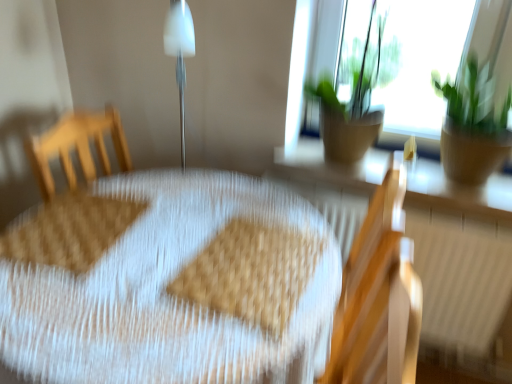
Measure the distance between point (x=437, y=293) and camera.

4.91 feet.

Where is `green leafy plant at upper right, arranged as the first houseplant when viewed from the right`? Image resolution: width=512 pixels, height=384 pixels. green leafy plant at upper right, arranged as the first houseplant when viewed from the right is located at coordinates (473, 126).

This screenshot has height=384, width=512. Describe the element at coordinates (352, 79) in the screenshot. I see `brown textured pot at upper right, which appears as the 1th houseplant when viewed from the left` at that location.

Find the location of a particular element. The width and height of the screenshot is (512, 384). wooden radiator at lower right is located at coordinates (462, 278).

Identify the location of radiator beneath the white woven table at center (from a real-world perspective). The width and height of the screenshot is (512, 384). (462, 278).

Between wooden radiator at lower right and white woven table at center, which one has larger size?

With larger size is white woven table at center.

Considering the relative sizes of wooden radiator at lower right and white woven table at center in the image provided, is wooden radiator at lower right wider than white woven table at center?

No, wooden radiator at lower right is not wider than white woven table at center.

Is point (436, 312) closer to camera compared to point (303, 354)?

No, (436, 312) is further to viewer.

Does white woven table at center turn towards wooden radiator at lower right?

No, white woven table at center is not turned towards wooden radiator at lower right.

Is white woven table at center placed right next to wooden radiator at lower right?

No.

Can you tell me how much white woven table at center and wooden radiator at lower right differ in facing direction?

1.21 degrees.

Which object is wider, white woven table at center or wooden radiator at lower right?

Wider between the two is white woven table at center.

At what (x,y) coordinates should I click in order to perform the action: click on the 2nd houseplant positioned above the white woven table at center (from a real-world perspective). Please return your answer as a coordinate pair (x, y). This screenshot has height=384, width=512. Looking at the image, I should click on (352, 79).

Is white woven table at center placed right next to brown textured pot at upper right, which appears as the 1th houseplant when viewed from the left?

No, white woven table at center is not with brown textured pot at upper right, which appears as the 1th houseplant when viewed from the left.

From a real-world perspective, which object stands above the other?

brown textured pot at upper right, marked as the second houseplant in a right-to-left arrangement, from a real-world perspective.

Between matte brown wood at upper right and green leafy plant at upper right, the second houseplant when ordered from left to right, which one is positioned behind?

matte brown wood at upper right is further away from the camera.

Which is closer to the camera, (423, 181) or (459, 151)?

Clearly, point (423, 181) is more distant from the camera than point (459, 151).

From a real-world perspective, is matte brown wood at upper right located higher than green leafy plant at upper right, arranged as the first houseplant when viewed from the right?

Actually, matte brown wood at upper right is physically below green leafy plant at upper right, arranged as the first houseplant when viewed from the right, in the real world.

How much distance is there between matte brown wood at upper right and green leafy plant at upper right, the second houseplant when ordered from left to right?

matte brown wood at upper right is 8.29 inches away from green leafy plant at upper right, the second houseplant when ordered from left to right.

Which of these two, brown textured pot at upper right, marked as the second houseplant in a right-to-left arrangement, or green leafy plant at upper right, arranged as the first houseplant when viewed from the right, is bigger?

Bigger between the two is brown textured pot at upper right, marked as the second houseplant in a right-to-left arrangement.

Can you tell me how much brown textured pot at upper right, marked as the second houseplant in a right-to-left arrangement, and green leafy plant at upper right, the second houseplant when ordered from left to right, differ in facing direction?

The facing directions of brown textured pot at upper right, marked as the second houseplant in a right-to-left arrangement, and green leafy plant at upper right, the second houseplant when ordered from left to right, are 1.1 degrees apart.

Is brown textured pot at upper right, which appears as the 1th houseplant when viewed from the left, turned away from green leafy plant at upper right, the second houseplant when ordered from left to right?

brown textured pot at upper right, which appears as the 1th houseplant when viewed from the left, does not have its back to green leafy plant at upper right, the second houseplant when ordered from left to right.

Is point (328, 68) more distant than point (481, 176)?

Yes, point (328, 68) is behind point (481, 176).

Is green leafy plant at upper right, the second houseplant when ordered from left to right, surrounding wooden chair at right?

No, wooden chair at right is located outside of green leafy plant at upper right, the second houseplant when ordered from left to right.

Is green leafy plant at upper right, arranged as the first houseplant when viewed from the right, wider than wooden chair at right?

Yes.

Which object is positioned more to the left, green leafy plant at upper right, arranged as the first houseplant when viewed from the right, or wooden chair at right?

Positioned to the left is wooden chair at right.

Considering the sizes of green leafy plant at upper right, arranged as the first houseplant when viewed from the right, and wooden chair at right in the image, is green leafy plant at upper right, arranged as the first houseplant when viewed from the right, bigger or smaller than wooden chair at right?

Considering their sizes, green leafy plant at upper right, arranged as the first houseplant when viewed from the right, takes up less space than wooden chair at right.

Between point (301, 217) and point (334, 379), which one is positioned behind?

Positioned behind is point (301, 217).

Which object is further away from the camera, white woven table at center or wooden chair at right?

wooden chair at right is further from the camera.

Would you say white woven table at center is inside or outside wooden chair at right?

white woven table at center cannot be found inside wooden chair at right.

Which is more to the right, white woven table at center or wooden chair at right?

wooden chair at right.

You are a GUI agent. You are given a task and a screenshot of the screen. Output one action in this format:
    pyautogui.click(x=<x>, y=<y>)
    Task: Click on the radiator that is on the right side of white woven table at center
    
    Given the screenshot: What is the action you would take?
    pyautogui.click(x=462, y=278)

Where is `radiator lying above the white woven table at center (from the image's perspective)`? radiator lying above the white woven table at center (from the image's perspective) is located at coordinates (462, 278).

From the image, which object appears to be nearer to brown textured pot at upper right, marked as the second houseplant in a right-to-left arrangement, green leafy plant at upper right, arranged as the first houseplant when viewed from the right, or matte brown wood at upper right?

The object closer to brown textured pot at upper right, marked as the second houseplant in a right-to-left arrangement, is matte brown wood at upper right.

Estimate the real-world distances between objects in this image. Which object is closer to wooden chair at right, wooden radiator at lower right or green leafy plant at upper right, arranged as the first houseplant when viewed from the right?

wooden radiator at lower right is positioned closer to the anchor wooden chair at right.

Considering their positions, is matte brown wood at upper right positioned closer to wooden radiator at lower right than white woven table at center?

matte brown wood at upper right lies closer to wooden radiator at lower right than the other object.

Based on their spatial positions, is wooden chair at right or wooden radiator at lower right closer to green leafy plant at upper right, the second houseplant when ordered from left to right?

Based on the image, wooden radiator at lower right appears to be nearer to green leafy plant at upper right, the second houseplant when ordered from left to right.

From the image, which object appears to be nearer to matte brown wood at upper right, white woven table at center or green leafy plant at upper right, the second houseplant when ordered from left to right?

Among the two, green leafy plant at upper right, the second houseplant when ordered from left to right, is located nearer to matte brown wood at upper right.

When comparing their distances from wooden radiator at lower right, does white woven table at center or matte brown wood at upper right seem further?

Based on the image, white woven table at center appears to be further to wooden radiator at lower right.

Based on their spatial positions, is white woven table at center or wooden chair at right closer to brown textured pot at upper right, which appears as the 1th houseplant when viewed from the left?

wooden chair at right.

When comparing their distances from white woven table at center, does brown textured pot at upper right, which appears as the 1th houseplant when viewed from the left, or green leafy plant at upper right, arranged as the first houseplant when viewed from the right, seem closer?

brown textured pot at upper right, which appears as the 1th houseplant when viewed from the left, is positioned closer to the anchor white woven table at center.

This screenshot has width=512, height=384. Identify the location of radiator between matte brown wood at upper right and wooden chair at right in the vertical direction. (462, 278).

Image resolution: width=512 pixels, height=384 pixels. Find the location of `houseplant between brown textured pot at upper right, marked as the second houseplant in a right-to-left arrangement, and wooden radiator at lower right vertically`. houseplant between brown textured pot at upper right, marked as the second houseplant in a right-to-left arrangement, and wooden radiator at lower right vertically is located at coordinates (x=473, y=126).

Where is `window sill between brown textured pot at upper right, marked as the second houseplant in a right-to-left arrangement, and wooden radiator at lower right in the up-down direction`? window sill between brown textured pot at upper right, marked as the second houseplant in a right-to-left arrangement, and wooden radiator at lower right in the up-down direction is located at coordinates (460, 191).

I want to click on houseplant between brown textured pot at upper right, marked as the second houseplant in a right-to-left arrangement, and wooden chair at right from top to bottom, so click(x=473, y=126).